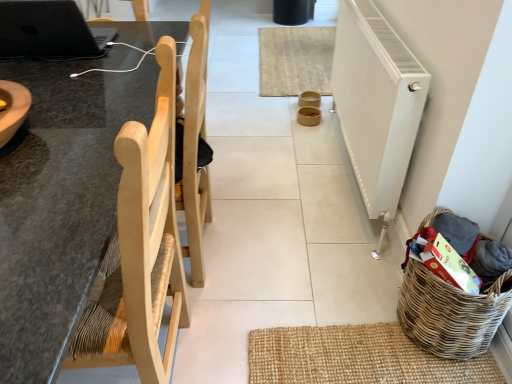
Where is `free space in front of white textured radiator at right`? free space in front of white textured radiator at right is located at coordinates (315, 256).